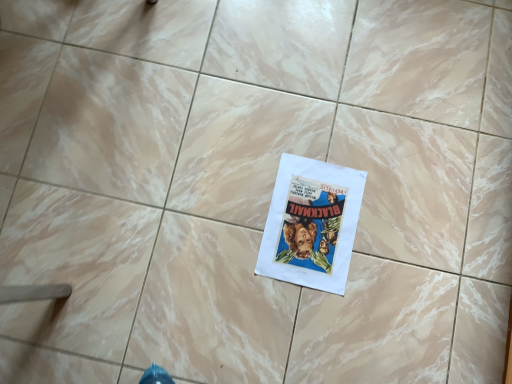
Locate an element on the screen. The width and height of the screenshot is (512, 384). free location in front of white paper poster at center is located at coordinates (316, 331).